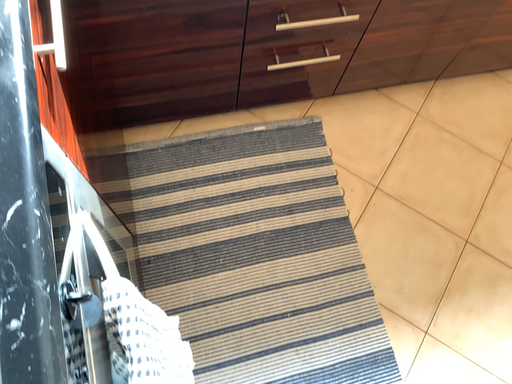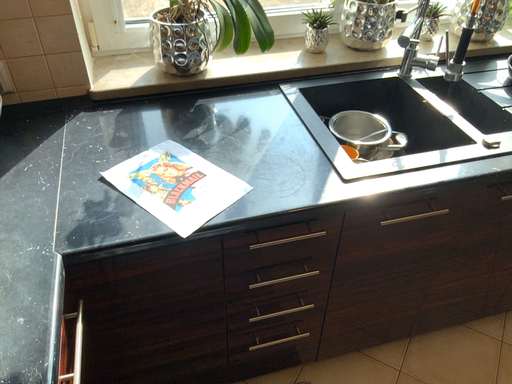
Question: How did the camera likely rotate when shooting the video?

Choices:
 (A) rotated downward
 (B) rotated upward

Answer: (B)